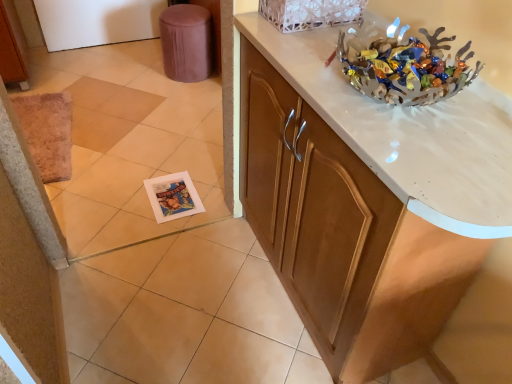
Locate an element on the screen. This screenshot has height=384, width=512. free space in front of brown fabric stool at upper left is located at coordinates click(181, 97).